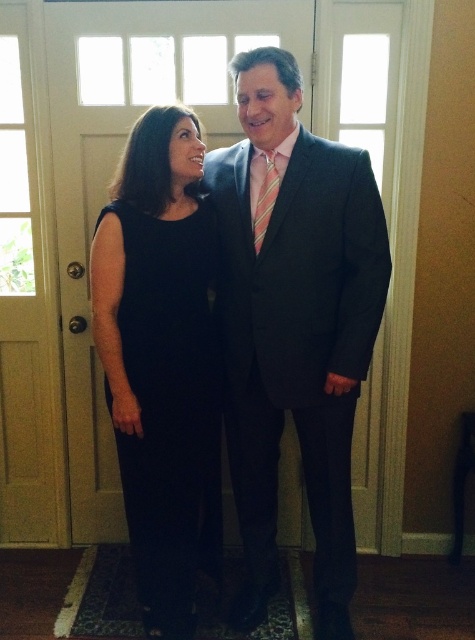
Is black satin dress at left in front of striped silk tie at center?

Yes, it is.

Looking at this image, can you confirm if black satin dress at left is positioned below striped silk tie at center?

Yes.

Measure the distance between point [159,259] and camera.

Point [159,259] is 1.91 meters from camera.

This screenshot has height=640, width=475. In order to click on black satin dress at left in this screenshot , I will do `click(171, 403)`.

Find the location of a particular element. This screenshot has height=640, width=475. black satin dress at center is located at coordinates (294, 326).

Does black satin dress at center appear under black satin dress at left?

Actually, black satin dress at center is above black satin dress at left.

In the scene shown: Who is more forward, (233,410) or (161,244)?

Point (161,244) is more forward.

Find the location of a particular element. The width and height of the screenshot is (475, 640). black satin dress at center is located at coordinates (294, 326).

Does black satin dress at center have a larger size compared to striped silk tie at center?

Yes.

Can you confirm if black satin dress at center is positioned below striped silk tie at center?

Yes, black satin dress at center is below striped silk tie at center.

What do you see at coordinates (294, 326) in the screenshot? This screenshot has width=475, height=640. I see `black satin dress at center` at bounding box center [294, 326].

Image resolution: width=475 pixels, height=640 pixels. I want to click on black satin dress at center, so click(x=294, y=326).